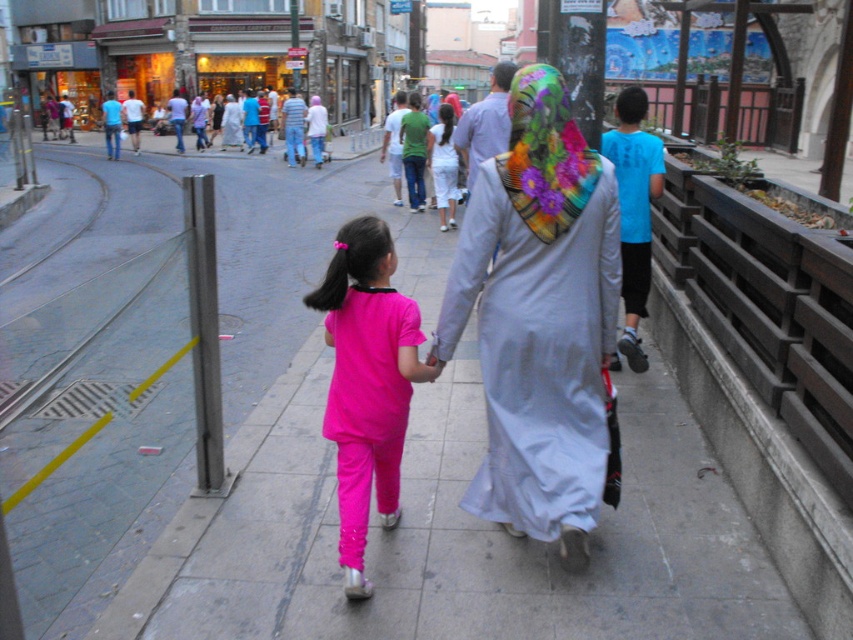
Question: Which object is farther from the camera taking this photo?

Choices:
 (A) light gray fabric dress at center
 (B) pink matte pants at center
 (C) blue t-shirt at right

Answer: (C)

Question: Does pink matte pants at center appear under blue t-shirt at right?

Choices:
 (A) no
 (B) yes

Answer: (B)

Question: Which object appears closest to the camera in this image?

Choices:
 (A) pink matte pants at center
 (B) blue t-shirt at right

Answer: (A)

Question: Does light gray fabric dress at center have a greater width compared to blue t-shirt at right?

Choices:
 (A) yes
 (B) no

Answer: (A)

Question: Is pink matte pants at center above blue t-shirt at right?

Choices:
 (A) yes
 (B) no

Answer: (B)

Question: Among these objects, which one is farthest from the camera?

Choices:
 (A) light gray fabric dress at center
 (B) pink matte pants at center
 (C) blue t-shirt at right

Answer: (C)